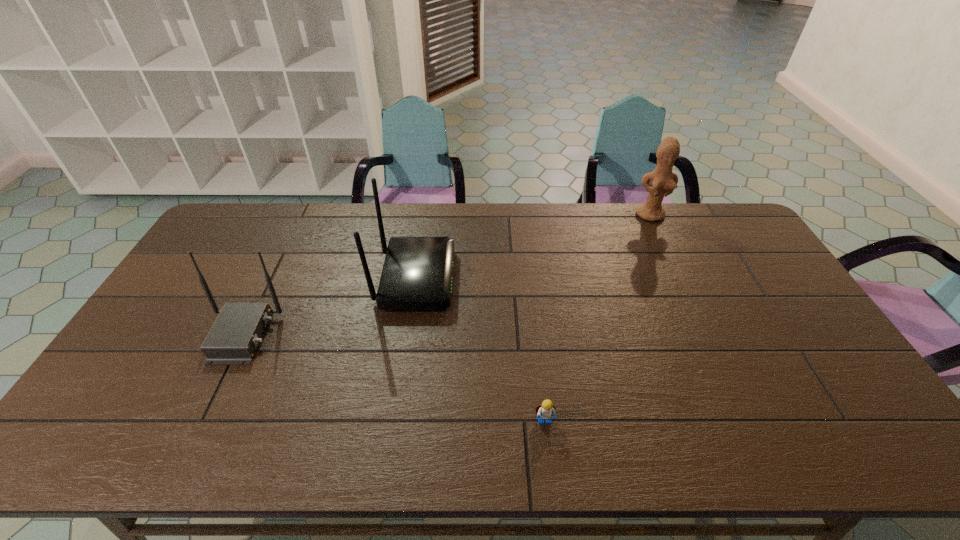
Where is `vacant space located 0.270m on the back of the left router to connect cables`? This screenshot has width=960, height=540. vacant space located 0.270m on the back of the left router to connect cables is located at coordinates (372, 335).

This screenshot has width=960, height=540. I want to click on object present at the far edge, so click(x=663, y=181).

You are a GUI agent. You are given a task and a screenshot of the screen. Output one action in this format:
    pyautogui.click(x=<x>, y=<y>)
    Task: Click on the object that is at the near edge
    
    Given the screenshot: What is the action you would take?
    pyautogui.click(x=545, y=410)

Locate an element on the screen. This screenshot has width=960, height=540. vacant area at the far edge is located at coordinates (533, 214).

I want to click on vacant space at the near edge of the desktop, so click(443, 427).

You are a GUI agent. You are given a task and a screenshot of the screen. Output one action in this format:
    pyautogui.click(x=<x>, y=<y>)
    Task: Click on the vacant space at the right edge of the desktop
    
    Given the screenshot: What is the action you would take?
    pyautogui.click(x=804, y=370)

You are a GUI agent. You are given a task and a screenshot of the screen. Output one action in this format:
    pyautogui.click(x=<x>, y=<y>)
    Task: Click on the vacant region at the far left corner of the desktop
    
    Given the screenshot: What is the action you would take?
    pyautogui.click(x=268, y=210)

Find the location of a particular element. Image resolution: width=960 pixels, height=540 pixels. free spot between the shorter router and the second object from left to right is located at coordinates 329,307.

Identify the location of blank region between the rightmost object and the third object from left to right. Image resolution: width=960 pixels, height=540 pixels. (597, 318).

This screenshot has width=960, height=540. Find the location of `vacant area that lies between the shorter router and the shortest object`. vacant area that lies between the shorter router and the shortest object is located at coordinates (394, 379).